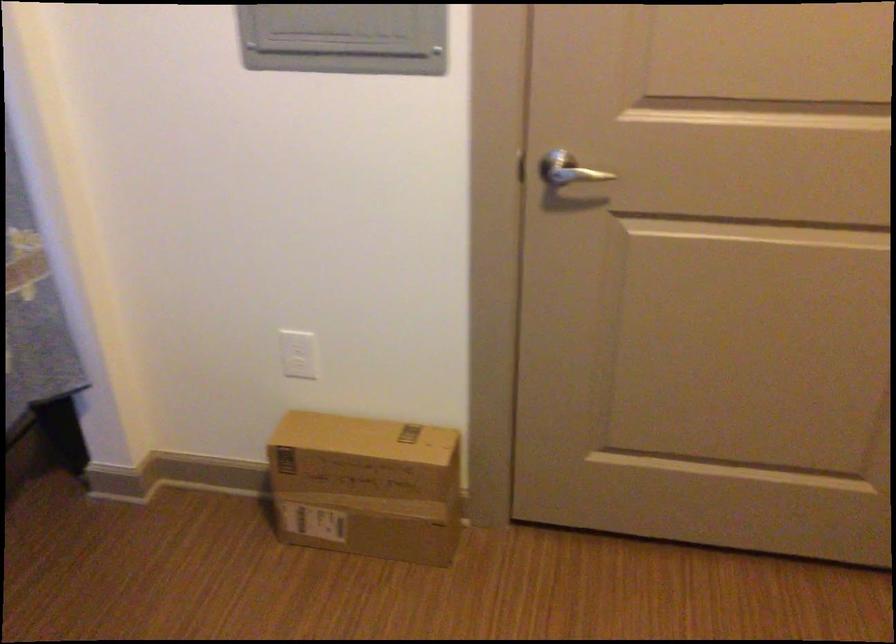
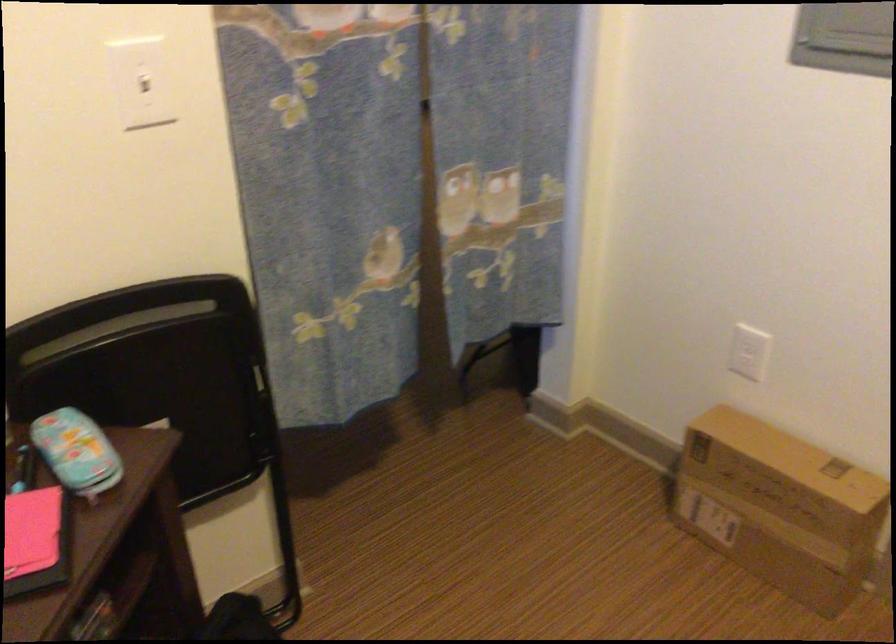
Question: The first image is from the beginning of the video and the second image is from the end. How did the camera likely rotate when shooting the video?

Choices:
 (A) Left
 (B) Right
 (C) Up
 (D) Down

Answer: (A)